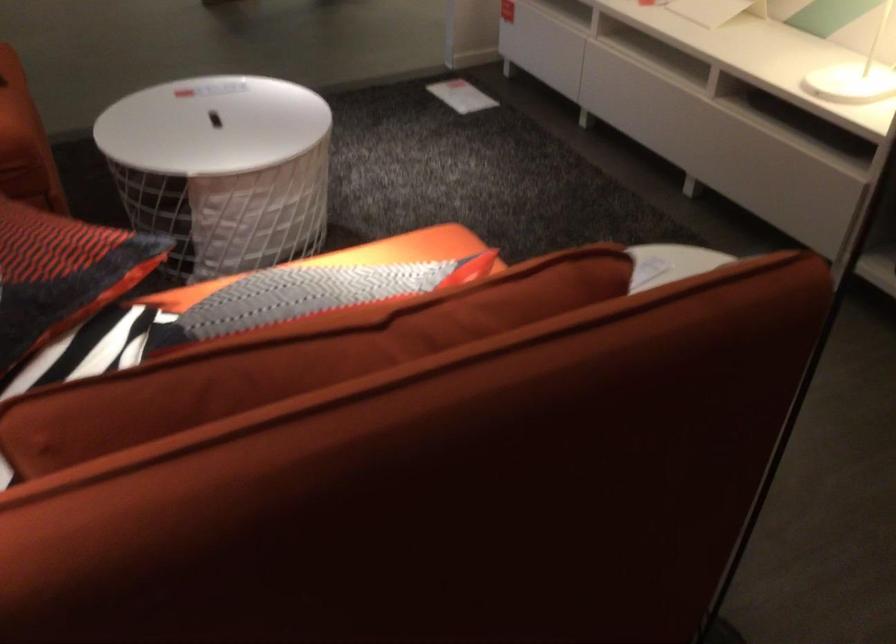
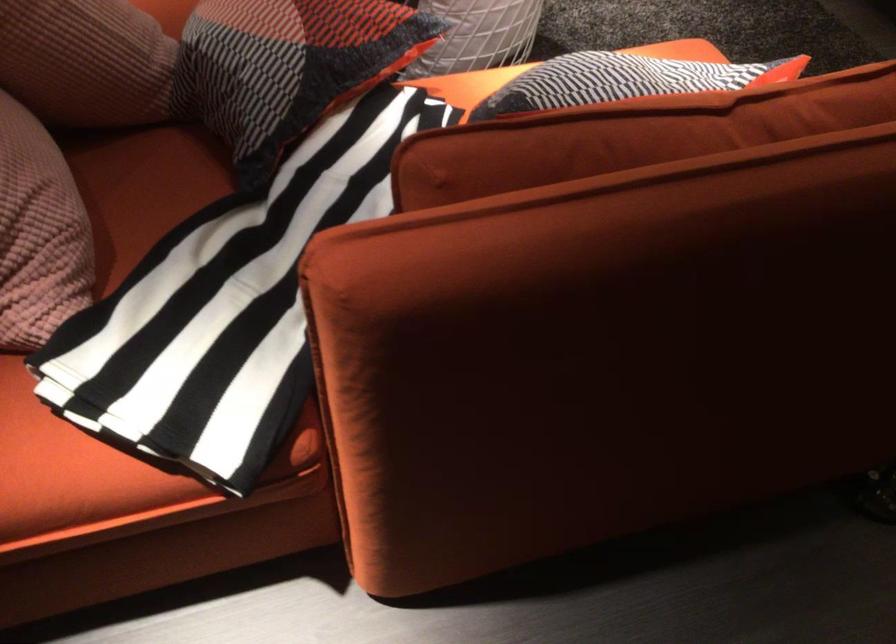
Question: The images are taken continuously from a first-person perspective. In which direction is your viewpoint rotating?

Choices:
 (A) Left
 (B) Right
 (C) Up
 (D) Down

Answer: (D)